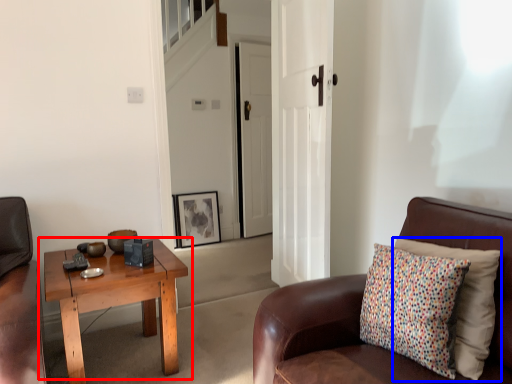
Question: Among these objects, which one is nearest to the camera, coffee table (highlighted by a red box) or pillow (highlighted by a blue box)?

Choices:
 (A) coffee table
 (B) pillow

Answer: (B)